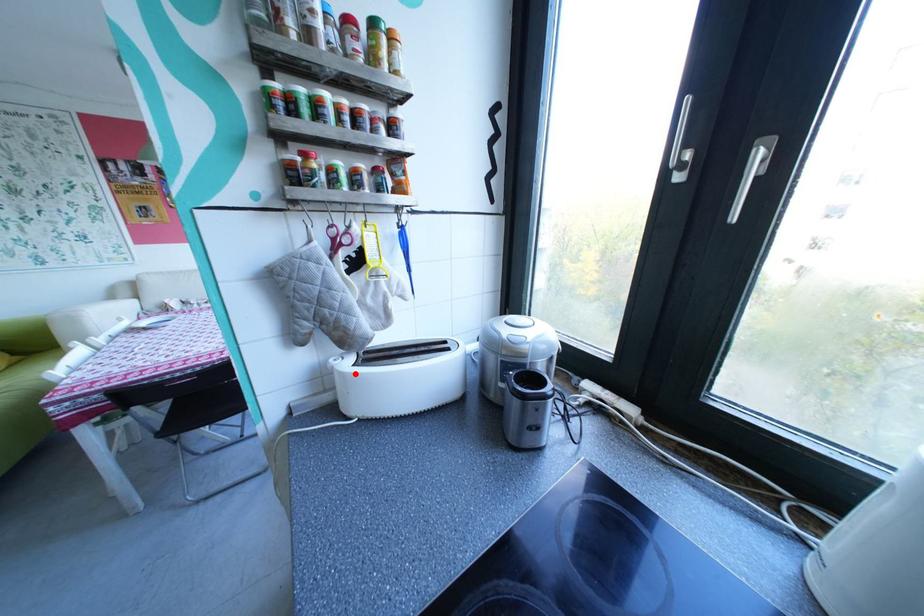
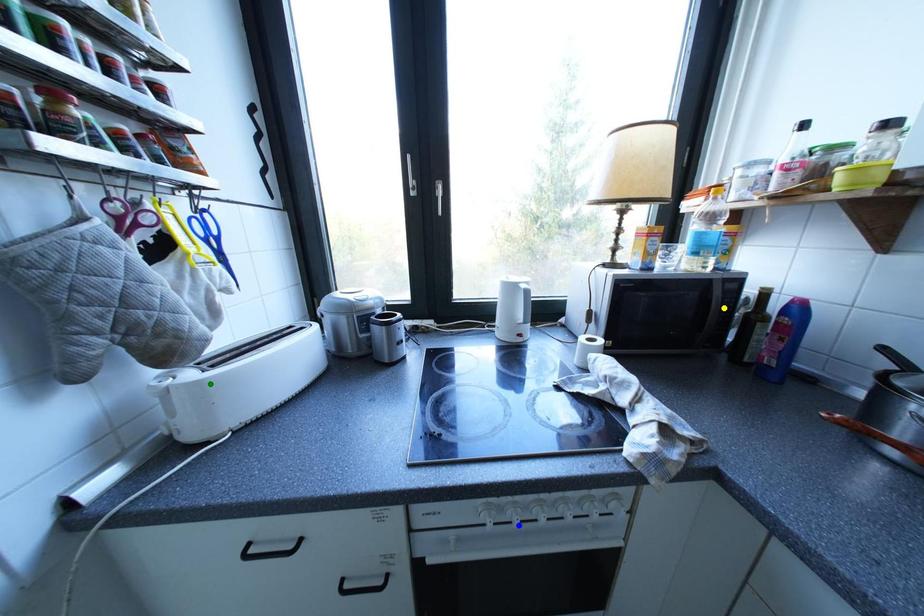
Question: I am providing you with two images of the same scene from different viewpoints. A red point is marked on the first image. You are given multiple points on the second image. Which point in image 2 represents the same 3d spot as the red point in image 1?

Choices:
 (A) yellow point
 (B) blue point
 (C) green point

Answer: (C)